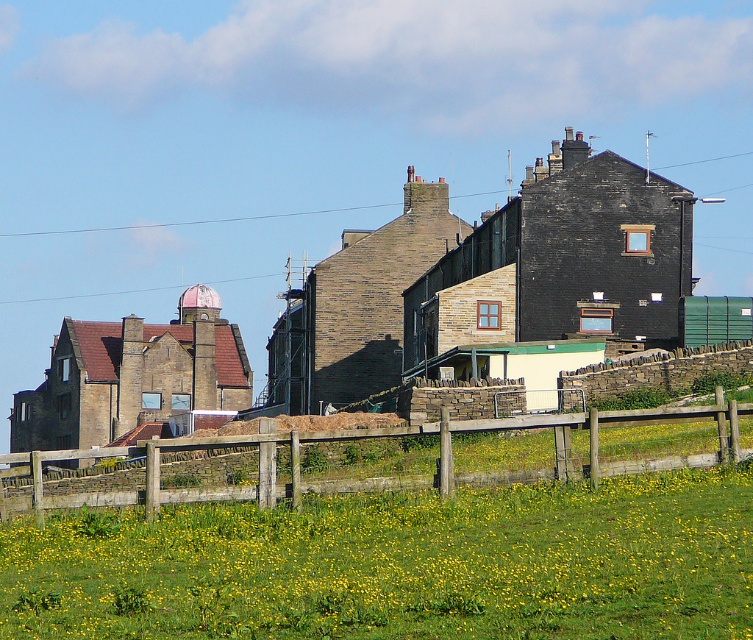
You are standing at the origin point of the coordinate system. You want to walk to the green grassy field at lower center. What are the coordinates you need to move to?

The coordinates to reach the green grassy field at lower center are at point (398, 564).

You are standing at the edge of the green grassy field at lower center and want to walk to the wooden fence at lower center. Based on their widths, which one do you think is narrower?

The green grassy field at lower center is narrower than the wooden fence at lower center because its width is less than the fence.